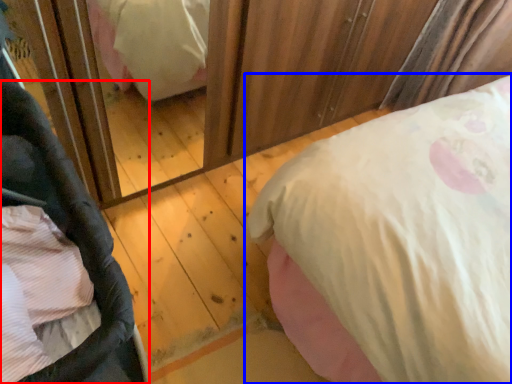
Question: Which of the following is the closest to the observer, baby carriage (highlighted by a red box) or bed (highlighted by a blue box)?

Choices:
 (A) baby carriage
 (B) bed

Answer: (A)